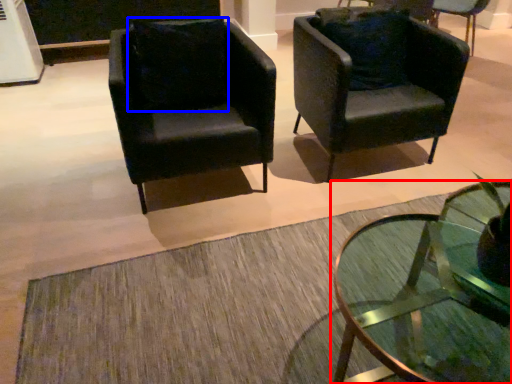
Question: Which point is further to the camera, coffee table (highlighted by a red box) or pillow (highlighted by a blue box)?

Choices:
 (A) coffee table
 (B) pillow

Answer: (B)